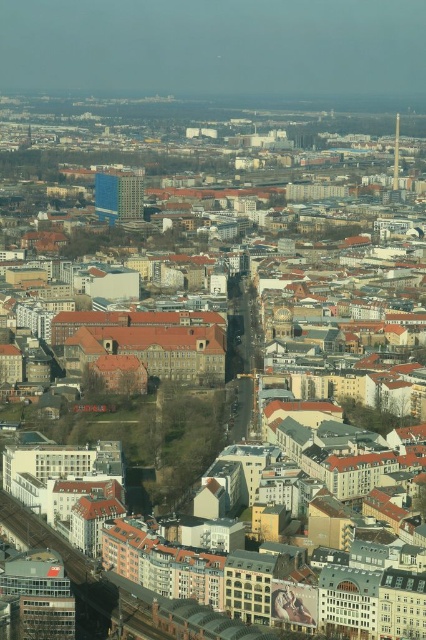
Question: Is blue glass building at center to the left of metallic silver tower at upper right from the viewer's perspective?

Choices:
 (A) yes
 (B) no

Answer: (A)

Question: Can you confirm if blue glass building at center is positioned to the right of metallic silver tower at upper right?

Choices:
 (A) no
 (B) yes

Answer: (A)

Question: Does blue glass building at center have a greater width compared to metallic silver tower at upper right?

Choices:
 (A) no
 (B) yes

Answer: (B)

Question: Which point is closer to the camera taking this photo?

Choices:
 (A) (394, 170)
 (B) (106, 188)

Answer: (B)

Question: Which of the following is the closest to the observer?

Choices:
 (A) (106, 189)
 (B) (396, 134)

Answer: (A)